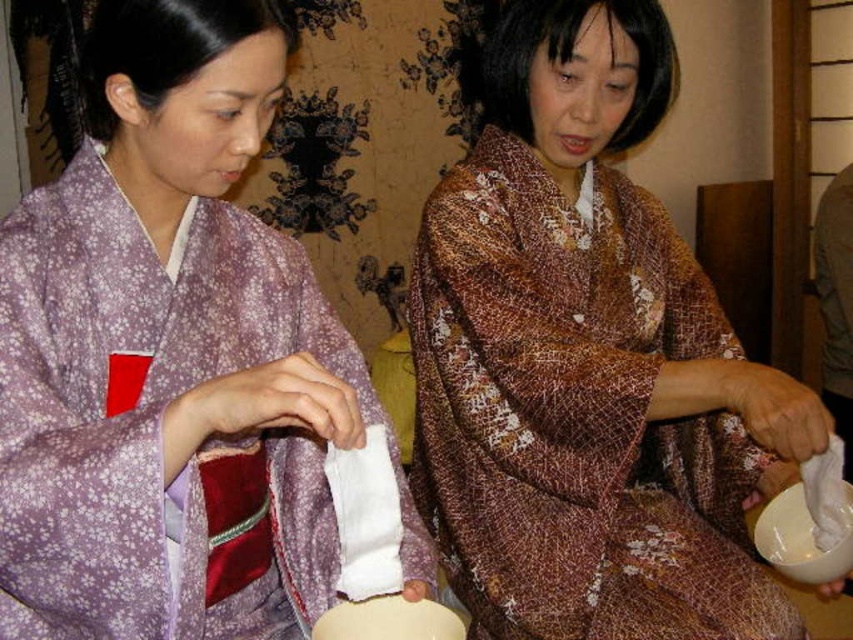
You are standing in a traditional Japanese room and see the white matte bowl at lower right. If you walk straight ahead, will you step over it?

The white matte bowl at lower right is located at point (802, 538), which is near the lower right corner of the scene. Since you are facing forward, walking straight ahead would take you away from the bowl, so you will not step over it.

You are standing in a traditional Japanese room and see the brown textured kimono at center. If you were to walk directly towards it from your current position, which direction should you move in?

The brown textured kimono at center is located at coordinates point (587,362), so you should move towards the center of the room to reach it.

You are a photographer planning to take a photo of the scene. You want to ensure the brown textured kimono at center is clearly visible without being blocked by the white fabric at lower right. Based on their positions, is this possible?

Yes, the brown textured kimono at center is in front of the white fabric at lower right, so it is not blocked and remains clearly visible.